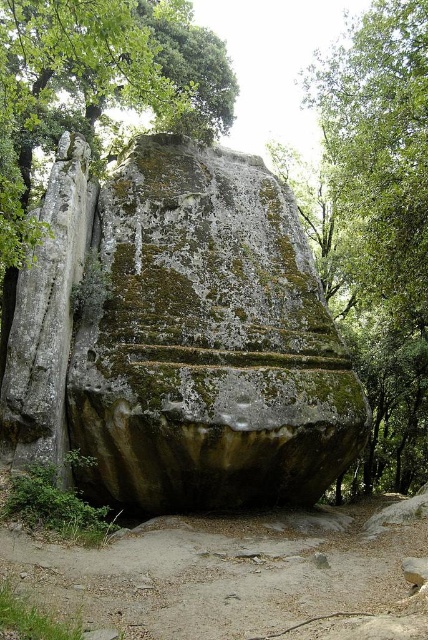
Question: Which point appears farthest from the camera in this image?

Choices:
 (A) (83, 392)
 (B) (187, 67)

Answer: (B)

Question: Is green mossy rock at center positioned in front of green mossy rock at upper center?

Choices:
 (A) no
 (B) yes

Answer: (A)

Question: From the image, what is the correct spatial relationship of green mossy rock at center in relation to green mossy rock at upper center?

Choices:
 (A) left
 (B) right

Answer: (B)

Question: Is green mossy rock at center wider than green mossy rock at upper center?

Choices:
 (A) no
 (B) yes

Answer: (B)